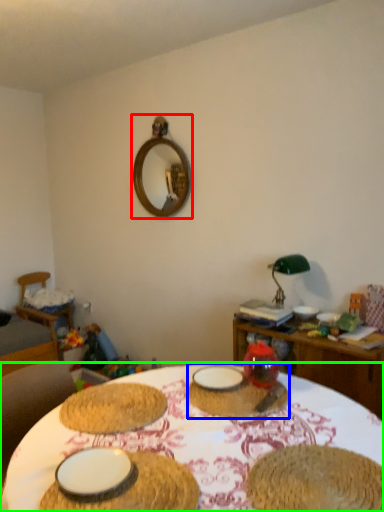
Question: Considering the real-world distances, which object is farthest from mirror (highlighted by a red box)? tableware (highlighted by a blue box) or table (highlighted by a green box)?

Choices:
 (A) tableware
 (B) table

Answer: (B)